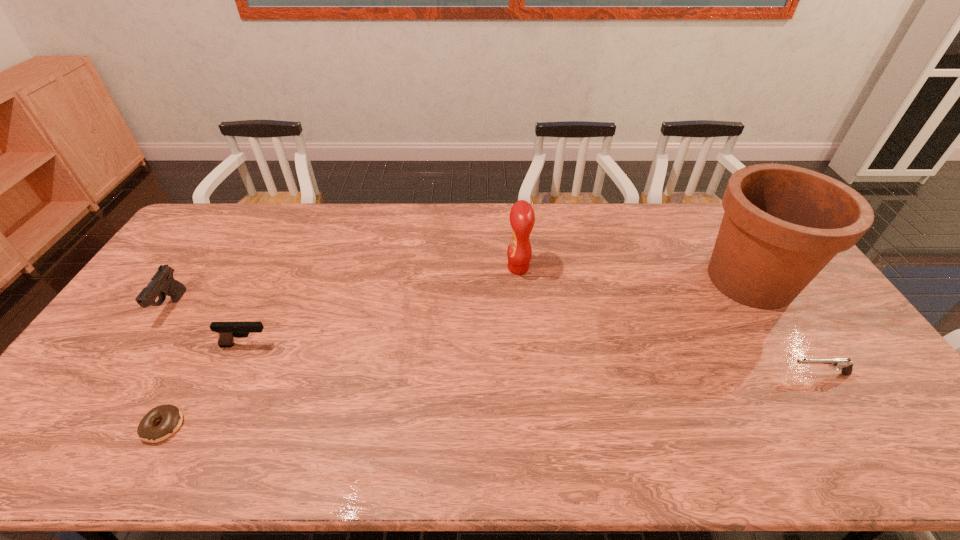
This screenshot has width=960, height=540. What are the coordinates of `doughnut` in the screenshot? It's located at (171, 417).

You are a GUI agent. You are given a task and a screenshot of the screen. Output one action in this format:
    pyautogui.click(x=<x>, y=<y>)
    Task: Click on the free location located 0.350m on the left of the tallest object
    
    Given the screenshot: What is the action you would take?
    pyautogui.click(x=587, y=280)

This screenshot has height=540, width=960. What are the coordinates of `free space located 0.280m on the label side of the third object from right to left` in the screenshot? It's located at (421, 268).

Image resolution: width=960 pixels, height=540 pixels. Find the location of `vacant space located on the label side of the third object from right to left`. vacant space located on the label side of the third object from right to left is located at coordinates (458, 268).

Locate an element on the screen. free location located 0.400m on the label side of the third object from right to left is located at coordinates (385, 268).

Image resolution: width=960 pixels, height=540 pixels. Find the location of `free space located at the barrel of the leftmost object`. free space located at the barrel of the leftmost object is located at coordinates (133, 363).

Where is `vacant space positioned on the front-facing side of the third nearest object`? The width and height of the screenshot is (960, 540). vacant space positioned on the front-facing side of the third nearest object is located at coordinates (380, 345).

This screenshot has width=960, height=540. Find the location of `vacant area situated on the front-facing side of the fifth farthest object`. vacant area situated on the front-facing side of the fifth farthest object is located at coordinates (651, 374).

This screenshot has height=540, width=960. Identify the location of vacant space located on the front-facing side of the fifth farthest object. (705, 374).

The image size is (960, 540). I want to click on free space located 0.080m on the front-facing side of the fifth farthest object, so click(757, 374).